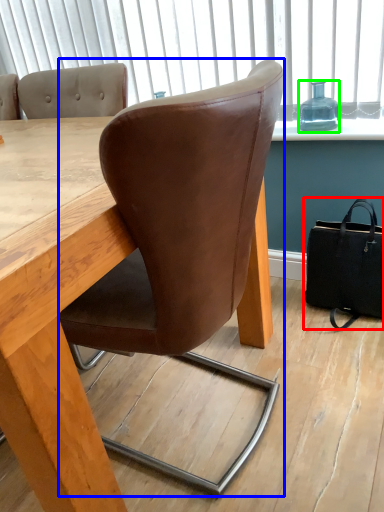
Question: Based on their relative distances, which object is nearer to handbag (highlighted by a red box)? Choose from chair (highlighted by a blue box) and bottle (highlighted by a green box).

Choices:
 (A) chair
 (B) bottle

Answer: (B)